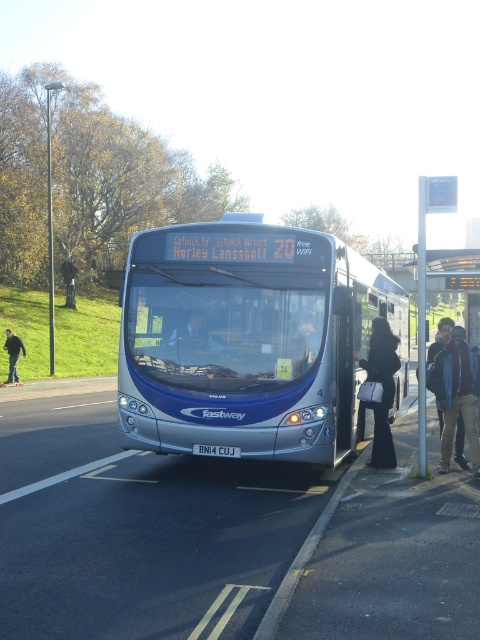
You are a photographer standing at the camera position. You want to capture a photo of the blue denim jacket at center. Given that the camera has a maximum zoom range of 20 feet, will you be able to take the photo without moving closer?

The blue denim jacket at center and camera are 26.63 feet apart, which exceeds the camera maximum zoom range of 20 feet. Therefore, you will not be able to take the photo without moving closer.

What is located at the point with coordinates (456, 394) in the image?

The blue denim jacket at center is located at the point with coordinates (456, 394).